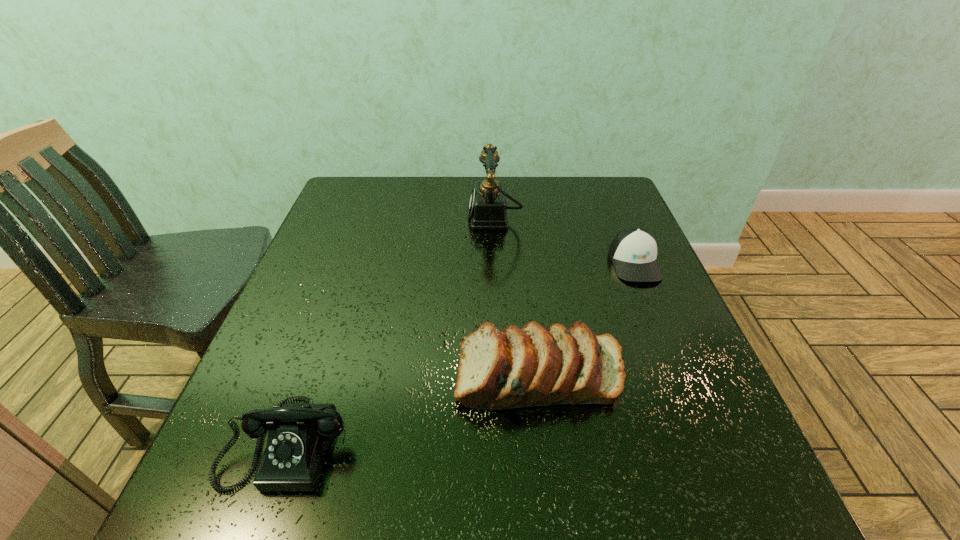
Where is `free space at the left edge of the desktop`? Image resolution: width=960 pixels, height=540 pixels. free space at the left edge of the desktop is located at coordinates (338, 246).

This screenshot has height=540, width=960. I want to click on blank space at the right edge of the desktop, so click(614, 231).

Image resolution: width=960 pixels, height=540 pixels. Find the location of `blank space at the near left corner`. blank space at the near left corner is located at coordinates (197, 498).

In order to click on blank area at the far right corner in this screenshot , I will do `click(595, 181)`.

This screenshot has width=960, height=540. Find the location of `blank region between the shorter telephone and the bread`. blank region between the shorter telephone and the bread is located at coordinates (415, 409).

Identify the location of vacant point located between the shorter telephone and the bread. (415, 409).

Where is `unoccupied area between the nearer telephone and the bread`? unoccupied area between the nearer telephone and the bread is located at coordinates (415, 409).

In order to click on empty space between the nearer telephone and the right telephone in this screenshot , I will do `click(392, 330)`.

Where is `free spot between the bread and the taller telephone`? free spot between the bread and the taller telephone is located at coordinates (517, 296).

The width and height of the screenshot is (960, 540). I want to click on free space that is in between the cap and the bread, so click(x=588, y=319).